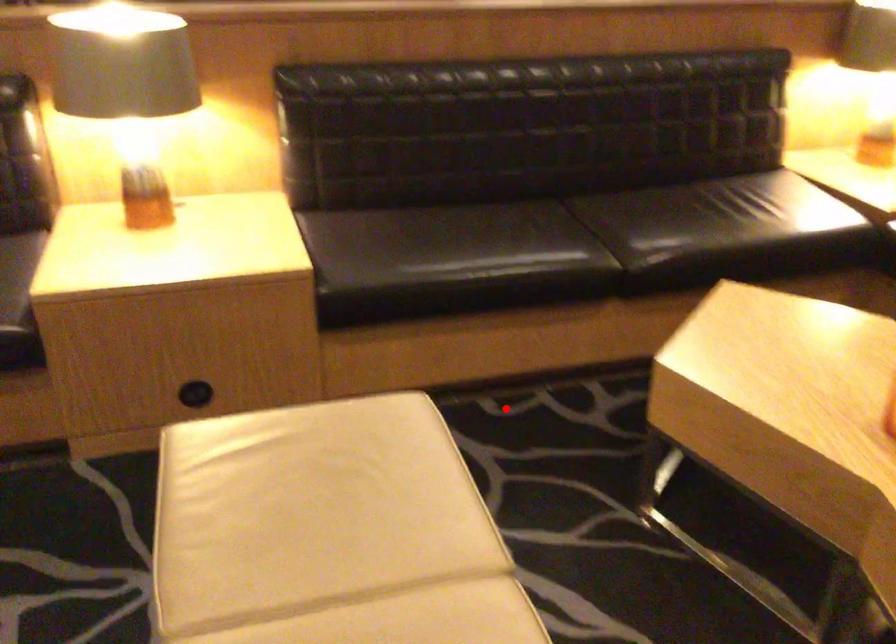
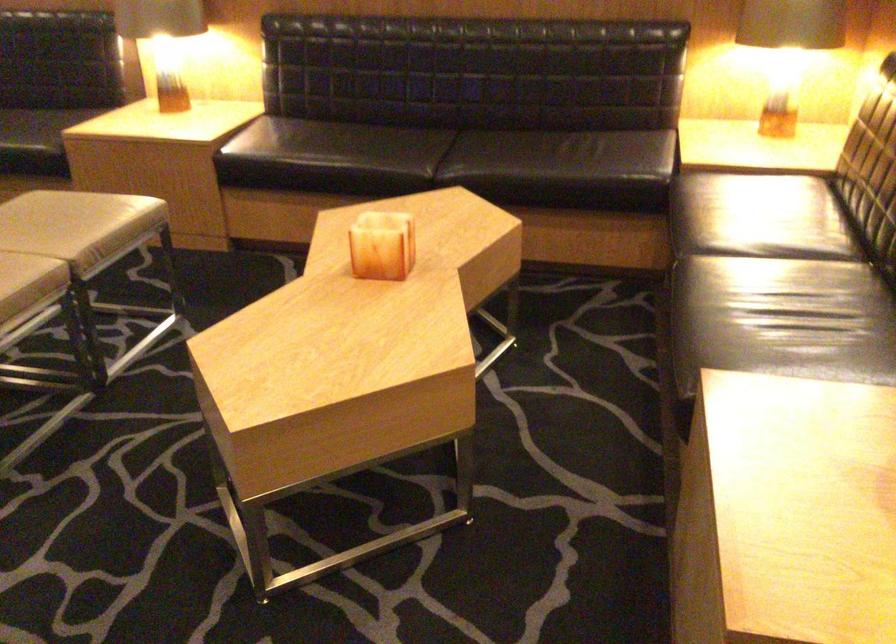
The point at the highlighted location is marked in the first image. Where is the corresponding point in the second image?

(283, 263)